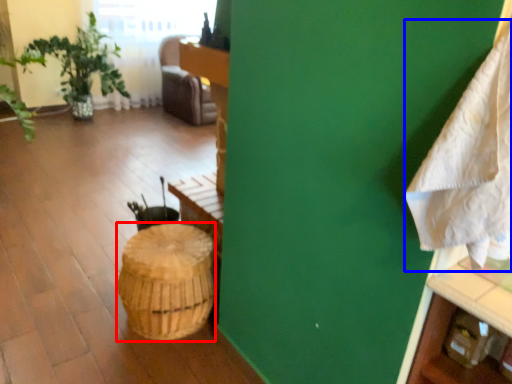
Question: Which point is further to the camera, basket (highlighted by a red box) or blanket (highlighted by a blue box)?

Choices:
 (A) basket
 (B) blanket

Answer: (A)